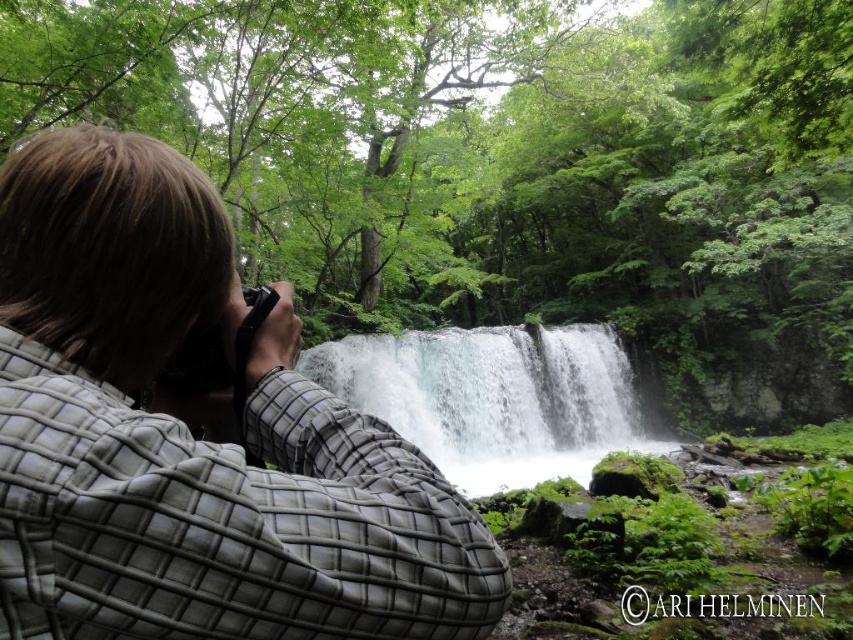
Question: Is the position of green leafy forest at center more distant than that of white frothy water at center?

Choices:
 (A) no
 (B) yes

Answer: (A)

Question: Which object is farther from the camera taking this photo?

Choices:
 (A) white frothy water at center
 (B) green leafy forest at center

Answer: (A)

Question: From the image, what is the correct spatial relationship of green leafy forest at center in relation to gray checkered shirt at center?

Choices:
 (A) right
 (B) left

Answer: (A)

Question: Does green leafy forest at center lie in front of white frothy water at center?

Choices:
 (A) yes
 (B) no

Answer: (A)

Question: Which object is positioned closest to the green leafy forest at center?

Choices:
 (A) white frothy water at center
 (B) gray checkered shirt at center

Answer: (A)

Question: Which of these objects is positioned closest to the white frothy water at center?

Choices:
 (A) green leafy forest at center
 (B) gray checkered shirt at center

Answer: (A)